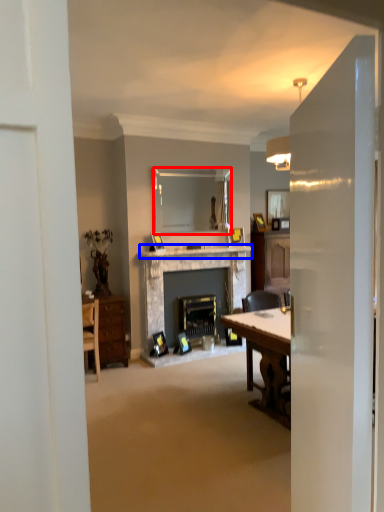
Question: Which of the following is the closest to the observer, mirror (highlighted by a red box) or mantle (highlighted by a blue box)?

Choices:
 (A) mirror
 (B) mantle

Answer: (B)